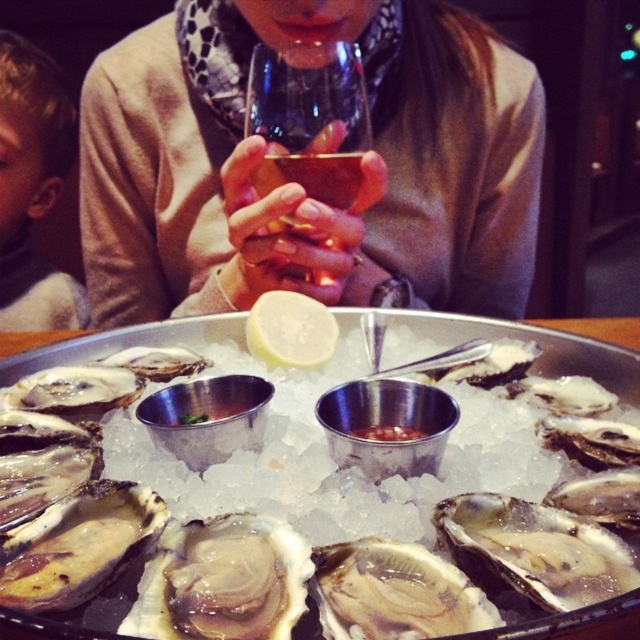
Question: Which is nearer to the yellow matte lemon at center?

Choices:
 (A) blonde hair at upper left
 (B) transparent glass wine glass at center
 (C) shiny silver oyster at center

Answer: (B)

Question: Which point is closer to the camera?

Choices:
 (A) shiny silver oyster at center
 (B) transparent glass wine glass at center
 (C) blonde hair at upper left

Answer: (A)

Question: Does shiny silver oyster at center appear under yellow matte lemon at center?

Choices:
 (A) no
 (B) yes

Answer: (A)

Question: Which of these objects is positioned farthest from the matte beige sweater at center?

Choices:
 (A) blonde hair at upper left
 (B) yellow matte lemon at center
 (C) transparent glass wine glass at center

Answer: (A)

Question: Does matte beige sweater at center appear over transparent glass wine glass at center?

Choices:
 (A) no
 (B) yes

Answer: (B)

Question: Is matte beige sweater at center above shiny silver oyster at center?

Choices:
 (A) no
 (B) yes

Answer: (B)